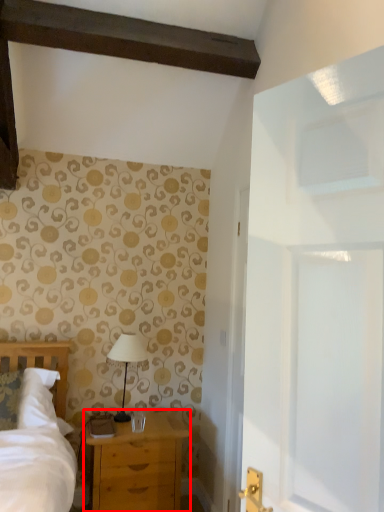
Question: From the image's perspective, considering the relative positions of chest of drawers (annotated by the red box) and table lamp in the image provided, where is chest of drawers (annotated by the red box) located with respect to the staircase?

Choices:
 (A) above
 (B) below

Answer: (B)